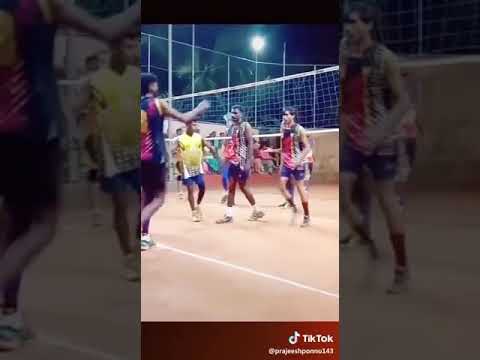
The width and height of the screenshot is (480, 360). I want to click on light, so click(x=257, y=43).